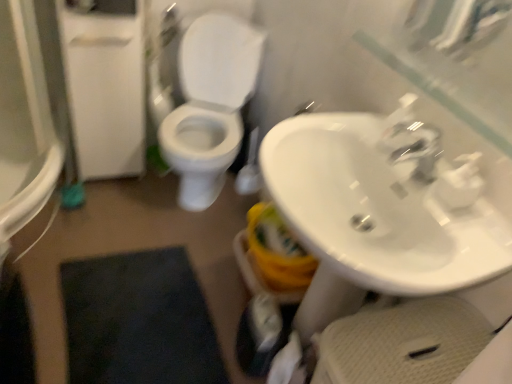
Question: Is white glossy sink at center right to the right of white glossy toilet at center from the viewer's perspective?

Choices:
 (A) no
 (B) yes

Answer: (B)

Question: From a real-world perspective, is white glossy sink at center right beneath white glossy toilet at center?

Choices:
 (A) no
 (B) yes

Answer: (A)

Question: From the image's perspective, would you say white glossy sink at center right is positioned over white glossy toilet at center?

Choices:
 (A) no
 (B) yes

Answer: (A)

Question: Is the depth of white glossy sink at center right greater than that of white glossy toilet at center?

Choices:
 (A) no
 (B) yes

Answer: (A)

Question: From the image's perspective, is white glossy sink at center right located beneath white glossy toilet at center?

Choices:
 (A) no
 (B) yes

Answer: (B)

Question: Considering the relative sizes of white glossy sink at center right and white glossy toilet at center in the image provided, is white glossy sink at center right wider than white glossy toilet at center?

Choices:
 (A) yes
 (B) no

Answer: (B)

Question: Is white matte toilet paper at lower center at the right side of white glossy sink at center right?

Choices:
 (A) no
 (B) yes

Answer: (A)

Question: From the image's perspective, is white matte toilet paper at lower center over white glossy sink at center right?

Choices:
 (A) yes
 (B) no

Answer: (B)

Question: From a real-world perspective, is white matte toilet paper at lower center on white glossy sink at center right?

Choices:
 (A) no
 (B) yes

Answer: (A)

Question: Is white matte toilet paper at lower center far from white glossy sink at center right?

Choices:
 (A) no
 (B) yes

Answer: (A)

Question: Can you confirm if white matte toilet paper at lower center is bigger than white glossy sink at center right?

Choices:
 (A) no
 (B) yes

Answer: (A)

Question: Is white matte toilet paper at lower center with white glossy sink at center right?

Choices:
 (A) yes
 (B) no

Answer: (B)

Question: Is the surface of white matte toilet paper at lower center in direct contact with white glossy toilet at center?

Choices:
 (A) no
 (B) yes

Answer: (A)